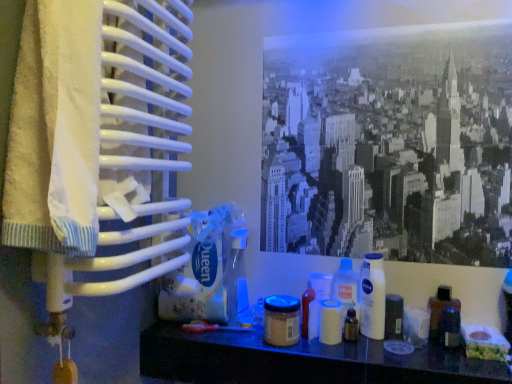
Describe the element at coordinates (281, 320) in the screenshot. Image resolution: width=512 pixels, height=384 pixels. I see `brown matte jar at center, the sixth toiletry from the right` at that location.

What is the approximate width of white plastic jar at center, the 3th toiletry when ordered from right to left?

2.57 inches.

What do you see at coordinates (237, 276) in the screenshot?
I see `transparent plastic bottle at center, the 1th toiletry viewed from the left` at bounding box center [237, 276].

What do you see at coordinates (306, 308) in the screenshot? Image resolution: width=512 pixels, height=384 pixels. I see `translucent plastic tube at center, which is the third toiletry from left to right` at bounding box center [306, 308].

I want to click on translucent plastic bottle at lower center, the 2th toiletry viewed from the right, so click(351, 326).

Can you tell me how much translucent plastic bottle at lower center, the 2th toiletry viewed from the right, and translucent plastic bottle at lower right, the first bottle when ordered from right to left, differ in facing direction?

There is a 0.000708-degree angle between the facing directions of translucent plastic bottle at lower center, the 2th toiletry viewed from the right, and translucent plastic bottle at lower right, the first bottle when ordered from right to left.

From the image's perspective, which object appears higher, translucent plastic bottle at lower center, the 2th toiletry viewed from the right, or translucent plastic bottle at lower right, the first bottle when ordered from right to left?

translucent plastic bottle at lower right, the first bottle when ordered from right to left, from the image's perspective.

Between point (349, 327) and point (430, 306), which one is positioned behind?

The point (349, 327) is more distant.

Between translucent plastic bottle at lower center, arranged as the 6th toiletry when viewed from the left, and translucent plastic bottle at lower right, the second bottle when ordered from left to right, which one has less height?

With less height is translucent plastic bottle at lower center, arranged as the 6th toiletry when viewed from the left.

From the image's perspective, starting from the matte plastic shelf at lower center, which toiletry is the 7th one above? Please provide its 2D coordinates.

[(237, 276)]

Is transparent plastic bottle at center, the seventh toiletry viewed from the right, far from matte plastic shelf at lower center?

That's not correct — transparent plastic bottle at center, the seventh toiletry viewed from the right, is a little close to matte plastic shelf at lower center.

Which of these two, transparent plastic bottle at center, the 1th toiletry viewed from the left, or matte plastic shelf at lower center, stands taller?

With more height is transparent plastic bottle at center, the 1th toiletry viewed from the left.

Between brown matte jar at center, the sixth toiletry from the right, and white plastic jar at center, the 3th toiletry when ordered from right to left, which one has larger size?

With larger size is brown matte jar at center, the sixth toiletry from the right.

Choose the correct answer: Is brown matte jar at center, which appears as the second toiletry when viewed from the left, inside white plastic jar at center, the 5th toiletry when ordered from left to right, or outside it?

brown matte jar at center, which appears as the second toiletry when viewed from the left, is not enclosed by white plastic jar at center, the 5th toiletry when ordered from left to right.

Is brown matte jar at center, which appears as the second toiletry when viewed from the left, turned away from white plastic jar at center, the 3th toiletry when ordered from right to left?

brown matte jar at center, which appears as the second toiletry when viewed from the left, is not turned away from white plastic jar at center, the 3th toiletry when ordered from right to left.

How far apart are brown matte jar at center, the sixth toiletry from the right, and white plastic jar at center, the 3th toiletry when ordered from right to left?

9.40 centimeters.

Is transparent plastic bottle at center, the 1th toiletry viewed from the left, oriented away from white plastic jar at center, the 5th toiletry when ordered from left to right?

That's not correct — transparent plastic bottle at center, the 1th toiletry viewed from the left, is not looking away from white plastic jar at center, the 5th toiletry when ordered from left to right.

Is transparent plastic bottle at center, the 1th toiletry viewed from the left, in contact with white plastic jar at center, the 3th toiletry when ordered from right to left?

transparent plastic bottle at center, the 1th toiletry viewed from the left, is not next to white plastic jar at center, the 3th toiletry when ordered from right to left, and they're not touching.

From the image's perspective, would you say transparent plastic bottle at center, the seventh toiletry viewed from the right, is positioned over white plastic jar at center, the 5th toiletry when ordered from left to right?

Yes.

Can you tell me how much white plastic bottle at center-right, the 1th bottle viewed from the left, and brown matte jar at center, which appears as the second toiletry when viewed from the left, differ in facing direction?

They differ by 17.5 degrees in their facing directions.

Which point is more forward, (381, 259) or (290, 326)?

The point (290, 326) is more forward.

The image size is (512, 384). I want to click on the 2nd bottle positioned above the brown matte jar at center, the sixth toiletry from the right (from a real-world perspective), so click(x=372, y=296).

Can you confirm if white plastic bottle at center-right, the 1th bottle viewed from the left, is shorter than brown matte jar at center, which appears as the second toiletry when viewed from the left?

No.

Between translucent plastic tube at center, which is the third toiletry from left to right, and transparent plastic bottle at center, the seventh toiletry viewed from the right, which one has less height?

With less height is translucent plastic tube at center, which is the third toiletry from left to right.

Considering the positions of objects translucent plastic tube at center, which is the third toiletry from left to right, and transparent plastic bottle at center, the seventh toiletry viewed from the right, in the image provided, who is more to the right, translucent plastic tube at center, which is the third toiletry from left to right, or transparent plastic bottle at center, the seventh toiletry viewed from the right,?

Positioned to the right is translucent plastic tube at center, which is the third toiletry from left to right.

Is translucent plastic tube at center, which is the third toiletry from left to right, with transparent plastic bottle at center, the seventh toiletry viewed from the right?

translucent plastic tube at center, which is the third toiletry from left to right, and transparent plastic bottle at center, the seventh toiletry viewed from the right, are clearly separated.

Is monochrome cityscape at upper center not inside translucent plastic bottle at lower center, arranged as the 6th toiletry when viewed from the left?

Yes.

Is monochrome cityscape at upper center facing towards translucent plastic bottle at lower center, arranged as the 6th toiletry when viewed from the left?

No, monochrome cityscape at upper center is not facing towards translucent plastic bottle at lower center, arranged as the 6th toiletry when viewed from the left.

Which is behind, monochrome cityscape at upper center or translucent plastic bottle at lower center, arranged as the 6th toiletry when viewed from the left?

translucent plastic bottle at lower center, arranged as the 6th toiletry when viewed from the left, is further away from the camera.

Can you tell me how much monochrome cityscape at upper center and translucent plastic bottle at lower center, the 2th toiletry viewed from the right, differ in facing direction?

0.486 degrees separate the facing orientations of monochrome cityscape at upper center and translucent plastic bottle at lower center, the 2th toiletry viewed from the right.

Locate an element on the screen. The image size is (512, 384). the 2nd toiletry counting from the left side of the translucent plastic bottle at lower right, the first bottle when ordered from right to left is located at coordinates (351, 326).

Image resolution: width=512 pixels, height=384 pixels. I want to click on furniture in front of the transparent plastic bottle at center, the seventh toiletry viewed from the right, so click(x=302, y=361).

Which object lies further to the anchor point brown matte jar at center, the sixth toiletry from the right, translucent plastic bottle at center or translucent plastic tube at center, which is the third toiletry from left to right?

Among the two, translucent plastic bottle at center is located further to brown matte jar at center, the sixth toiletry from the right.

Based on their spatial positions, is translucent plastic tube at center, which is the third toiletry from left to right, or transparent plastic bottle at center, the 1th toiletry viewed from the left, closer to white plastic container at center, positioned as the 4th toiletry in right-to-left order?

translucent plastic tube at center, which is the third toiletry from left to right, is closer to white plastic container at center, positioned as the 4th toiletry in right-to-left order.

Based on their spatial positions, is translucent plastic bottle at lower center, the 2th toiletry viewed from the right, or translucent plastic bottle at lower right, the first bottle when ordered from right to left, further from transparent plastic bottle at center, the seventh toiletry viewed from the right?

translucent plastic bottle at lower right, the first bottle when ordered from right to left, is positioned further to the anchor transparent plastic bottle at center, the seventh toiletry viewed from the right.

Which object lies further to the anchor point matte black container at lower right, placed as the 7th toiletry when sorted from left to right, translucent plastic bottle at lower center, the 2th toiletry viewed from the right, or white plastic bottle at center-right, which is counted as the second bottle, starting from the right?

translucent plastic bottle at lower center, the 2th toiletry viewed from the right, is further to matte black container at lower right, placed as the 7th toiletry when sorted from left to right.

Considering their positions, is translucent plastic bottle at lower right, the second bottle when ordered from left to right, positioned further to white plastic jar at center, the 3th toiletry when ordered from right to left, than matte black container at lower right, arranged as the 1th toiletry when viewed from the right?

translucent plastic bottle at lower right, the second bottle when ordered from left to right, is further to white plastic jar at center, the 3th toiletry when ordered from right to left.

Estimate the real-world distances between objects in this image. Which object is further from matte black container at lower right, arranged as the 1th toiletry when viewed from the right, brown matte jar at center, the sixth toiletry from the right, or translucent plastic bottle at lower right, the first bottle when ordered from right to left?

Based on the image, brown matte jar at center, the sixth toiletry from the right, appears to be further to matte black container at lower right, arranged as the 1th toiletry when viewed from the right.

Consider the image. Based on their spatial positions, is translucent plastic bottle at lower right, the second bottle when ordered from left to right, or white plastic bottle at center-right, the 1th bottle viewed from the left, closer to translucent plastic tube at center, the fifth toiletry from the right?

The object closer to translucent plastic tube at center, the fifth toiletry from the right, is white plastic bottle at center-right, the 1th bottle viewed from the left.

Considering their positions, is monochrome cityscape at upper center positioned further to translucent plastic bottle at lower right, the second bottle when ordered from left to right, than white plastic bottle at center-right, the 1th bottle viewed from the left?

monochrome cityscape at upper center lies further to translucent plastic bottle at lower right, the second bottle when ordered from left to right, than the other object.

Find the location of a particular element. This screenshot has width=512, height=384. cleaning product between translucent plastic tube at center, which is the third toiletry from left to right, and translucent plastic bottle at lower right, the second bottle when ordered from left to right, from left to right is located at coordinates (346, 286).

This screenshot has height=384, width=512. I want to click on furniture between transparent plastic bottle at center, the 1th toiletry viewed from the left, and white plastic bottle at center-right, the 1th bottle viewed from the left, so click(302, 361).

You are a GUI agent. You are given a task and a screenshot of the screen. Output one action in this format:
    pyautogui.click(x=<x>, y=<y>)
    Task: Click on the cleaning product between monochrome cityscape at upper center and brown matte jar at center, which appears as the second toiletry when viewed from the left, in the up-down direction
    The image size is (512, 384).
    Given the screenshot: What is the action you would take?
    pyautogui.click(x=346, y=286)

You are a GUI agent. You are given a task and a screenshot of the screen. Output one action in this format:
    pyautogui.click(x=<x>, y=<y>)
    Task: Click on the furniture situated between translucent plastic tube at center, the fifth toiletry from the right, and matte black container at lower right, arranged as the 1th toiletry when viewed from the right, from left to right
    
    Given the screenshot: What is the action you would take?
    pyautogui.click(x=302, y=361)